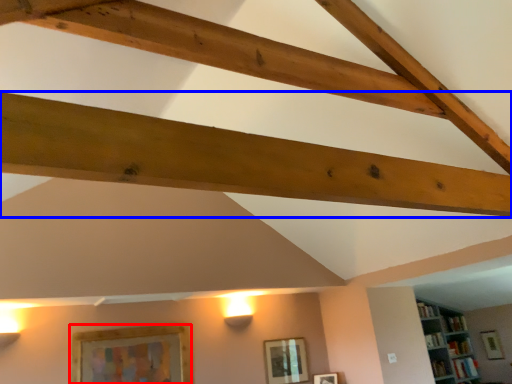
Question: Which object appears farthest to the camera in this image, picture frame (highlighted by a red box) or plank (highlighted by a blue box)?

Choices:
 (A) picture frame
 (B) plank

Answer: (A)